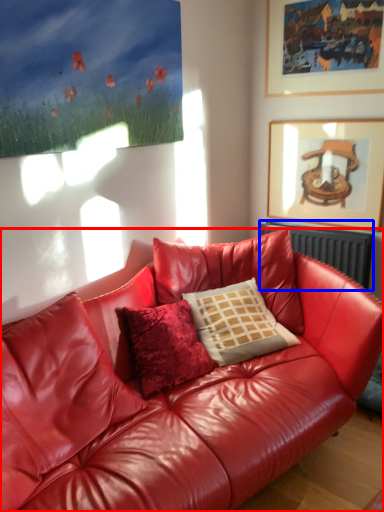
Question: Among these objects, which one is farthest to the camera, studio couch (highlighted by a red box) or radiator (highlighted by a blue box)?

Choices:
 (A) studio couch
 (B) radiator

Answer: (B)